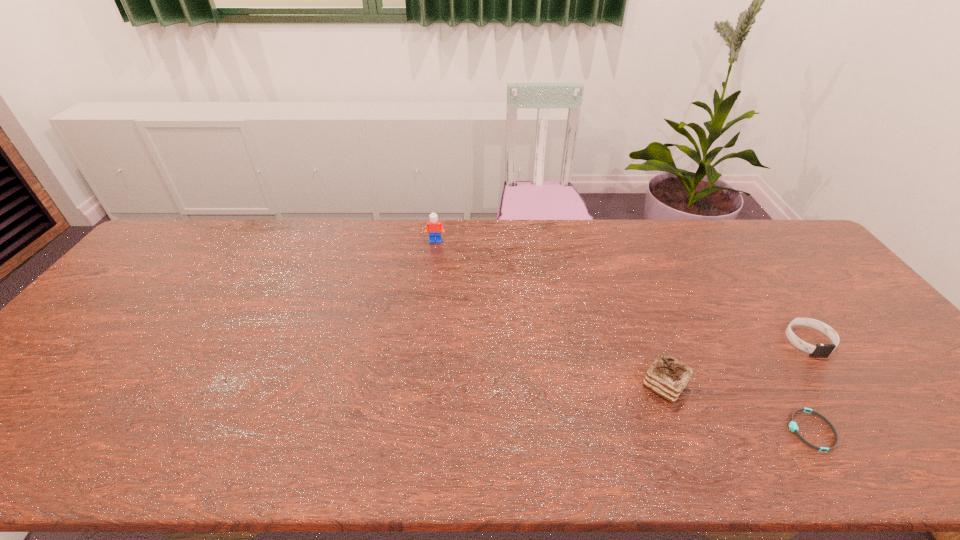
In the image, there is a desktop. In order to click on free region at the right edge in this screenshot , I will do `click(834, 278)`.

Identify the location of vacant space at the far left corner. (209, 233).

Locate an element on the screen. This screenshot has width=960, height=540. empty space between the shorter wristband and the third nearest object is located at coordinates (809, 386).

Locate an element on the screen. The image size is (960, 540). vacant point located between the third farthest object and the second shortest object is located at coordinates [736, 363].

Locate an element on the screen. The height and width of the screenshot is (540, 960). empty space that is in between the third object from right to left and the third tallest object is located at coordinates (736, 363).

At what (x,y) coordinates should I click in order to perform the action: click on unoccupied position between the shortest object and the Lego. Please return your answer as a coordinate pair (x, y). Image resolution: width=960 pixels, height=540 pixels. Looking at the image, I should click on (623, 336).

Where is `free spot between the second object from left to right and the farthest object`? free spot between the second object from left to right and the farthest object is located at coordinates (550, 313).

You are a GUI agent. You are given a task and a screenshot of the screen. Output one action in this format:
    pyautogui.click(x=<x>, y=<y>)
    Task: Click on the free space between the taller wristband and the second object from right to left
    This screenshot has width=960, height=540.
    Given the screenshot: What is the action you would take?
    pyautogui.click(x=809, y=386)

The image size is (960, 540). What are the coordinates of `vacant point located between the farther wristband and the shorter wristband` in the screenshot? It's located at (809, 386).

Locate an element on the screen. The width and height of the screenshot is (960, 540). vacant area between the shortest object and the taller wristband is located at coordinates (809, 386).